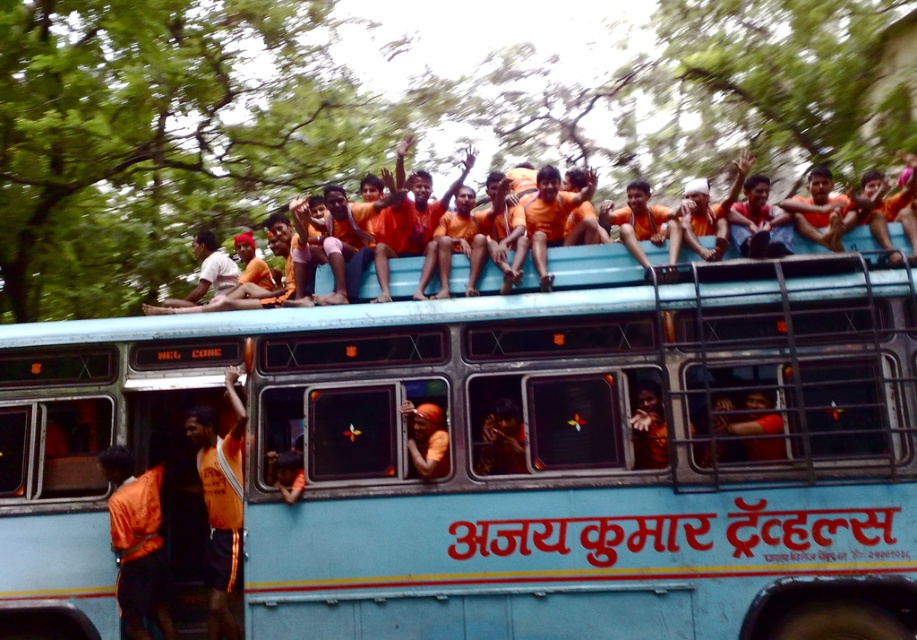
How much distance is there between light blue metallic bus at upper center and orange shirt at upper center?

13.18 feet

Between point (884, 384) and point (777, 432), which one is positioned behind?

The point (777, 432) is more distant.

Between point (528, 296) and point (774, 456), which one is positioned in front?

Point (774, 456) is in front.

The width and height of the screenshot is (917, 640). What are the coordinates of `light blue metallic bus at upper center` in the screenshot? It's located at (496, 474).

Between orange fabric shirt at upper center and orange shirt at upper center, which one is positioned higher?

orange fabric shirt at upper center

Is point (639, 260) positioned after point (763, 397)?

That is True.

Locate an element on the screen. orange fabric shirt at upper center is located at coordinates (589, 252).

Between light blue metallic bus at upper center and orange fabric shirt at upper center, which one has less height?

Standing shorter between the two is orange fabric shirt at upper center.

Between light blue metallic bus at upper center and orange fabric shirt at upper center, which one appears on the left side from the viewer's perspective?

light blue metallic bus at upper center

Where is `light blue metallic bus at upper center`? The width and height of the screenshot is (917, 640). light blue metallic bus at upper center is located at coordinates (496, 474).

Locate an element on the screen. This screenshot has width=917, height=640. light blue metallic bus at upper center is located at coordinates (496, 474).